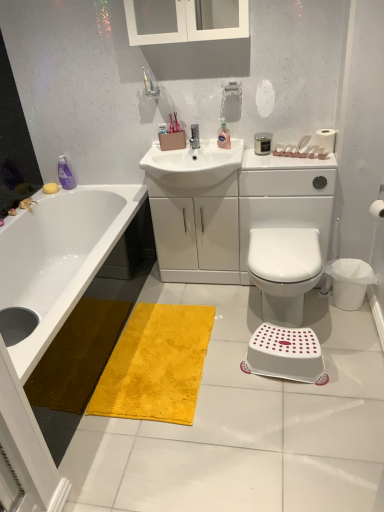
Where is `vacant region above white plastic step stool at lower center (from a real-world perspective)`? This screenshot has width=384, height=512. vacant region above white plastic step stool at lower center (from a real-world perspective) is located at coordinates (283, 343).